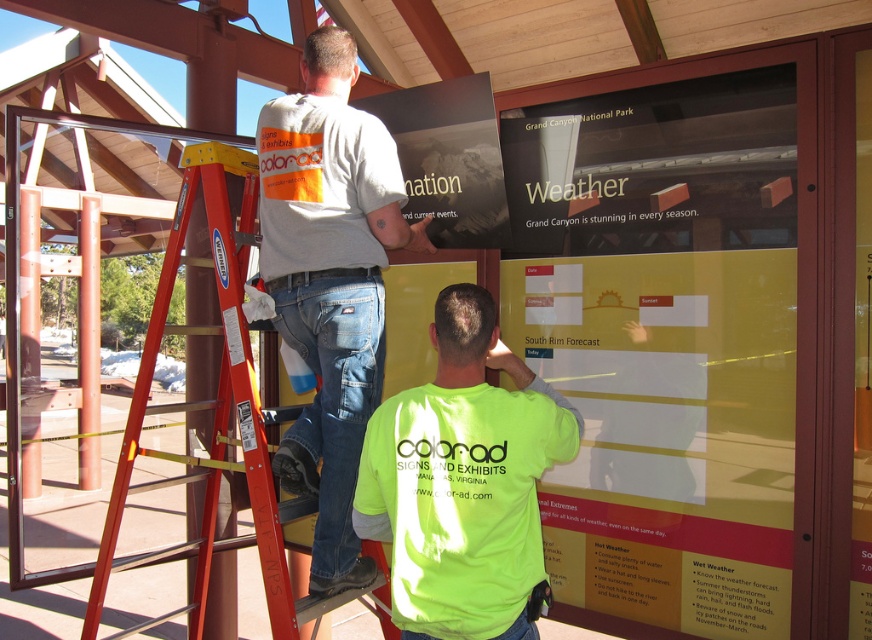
Which of these two, neon green shirt at center or red metal ladder at left, stands taller?

red metal ladder at left

Can you confirm if neon green shirt at center is smaller than red metal ladder at left?

Indeed, neon green shirt at center has a smaller size compared to red metal ladder at left.

Where is `neon green shirt at center`? neon green shirt at center is located at coordinates (462, 481).

This screenshot has width=872, height=640. Describe the element at coordinates (330, 282) in the screenshot. I see `white cotton shirt at upper center` at that location.

Consider the image. Which is more to the right, white cotton shirt at upper center or red metal ladder at left?

Positioned to the right is white cotton shirt at upper center.

Is point (317, 536) closer to camera compared to point (160, 454)?

Yes, point (317, 536) is in front of point (160, 454).

Identify the location of white cotton shirt at upper center. Image resolution: width=872 pixels, height=640 pixels. (330, 282).

Which is more to the left, white cotton shirt at upper center or neon green shirt at center?

From the viewer's perspective, white cotton shirt at upper center appears more on the left side.

Between white cotton shirt at upper center and neon green shirt at center, which one is positioned higher?

white cotton shirt at upper center

Who is more distant from viewer, (256, 145) or (409, 400)?

The point (256, 145) is more distant.

I want to click on white cotton shirt at upper center, so (330, 282).